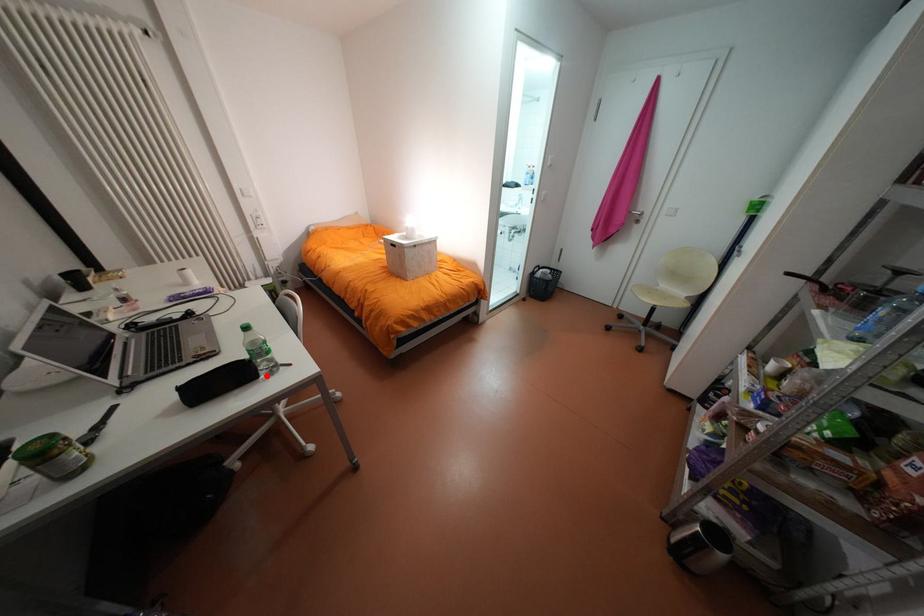
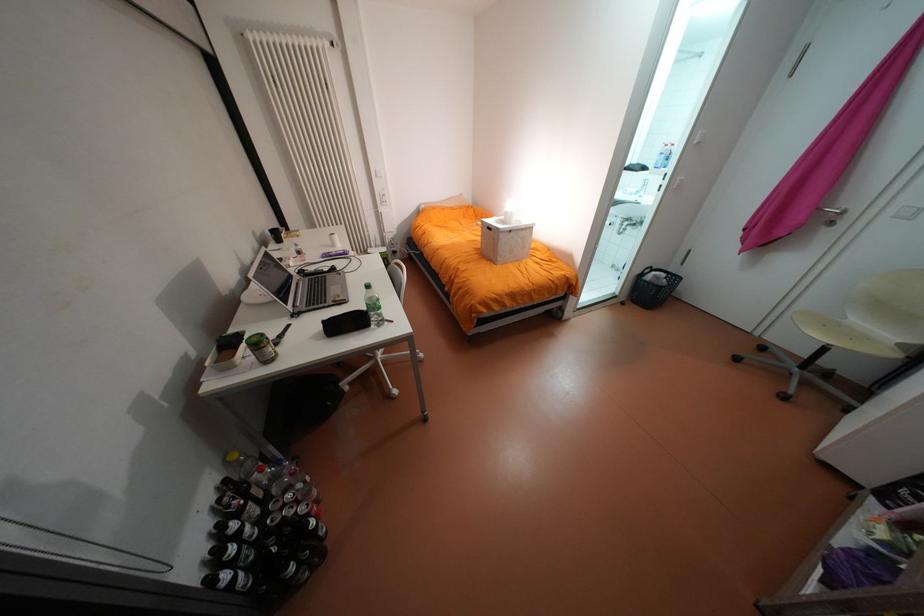
Find the pixel in the second image that matches the highlighted location in the first image.

(379, 325)